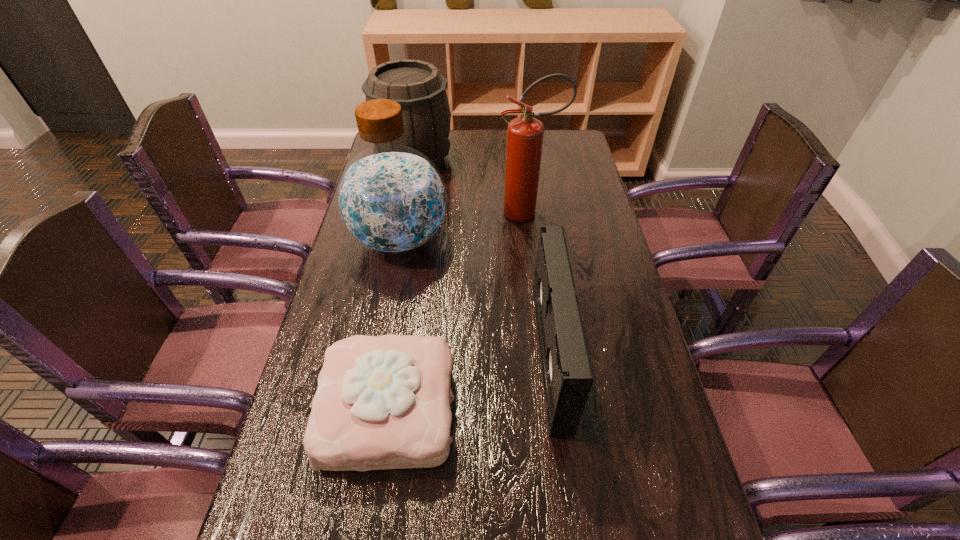
Locate an element on the screen. This screenshot has width=960, height=540. empty space that is in between the water jug and the fire extinguisher is located at coordinates (464, 226).

The width and height of the screenshot is (960, 540). I want to click on free space that is in between the wine bucket and the fire extinguisher, so click(x=470, y=186).

You are a GUI agent. You are given a task and a screenshot of the screen. Output one action in this format:
    pyautogui.click(x=<x>, y=<y>)
    Task: Click on the free spot between the water jug and the videotape
    
    Given the screenshot: What is the action you would take?
    pyautogui.click(x=475, y=296)

You are a GUI agent. You are given a task and a screenshot of the screen. Output one action in this format:
    pyautogui.click(x=<x>, y=<y>)
    Task: Click on the object that is the second closest to the fourth tallest object
    Image resolution: width=960 pixels, height=540 pixels.
    Given the screenshot: What is the action you would take?
    pyautogui.click(x=391, y=199)

Identify which object is the fourth nearest to the second shortest object. Please provide its 2D coordinates. Your answer should be formatted as a tuple, i.e. [(x, y)], where the tuple contains the x and y coordinates of a point satisfying the conditions above.

[(419, 88)]